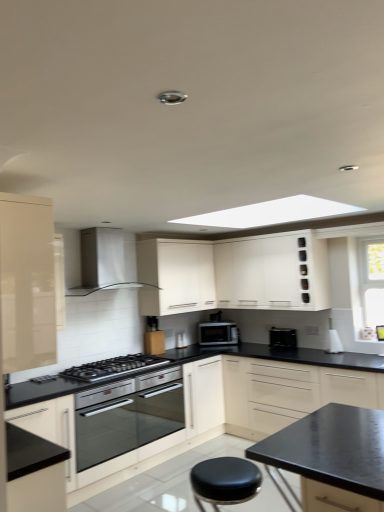
Where is `free space above black leather stool at lower center (from a real-world perspective)`? free space above black leather stool at lower center (from a real-world perspective) is located at coordinates (227, 470).